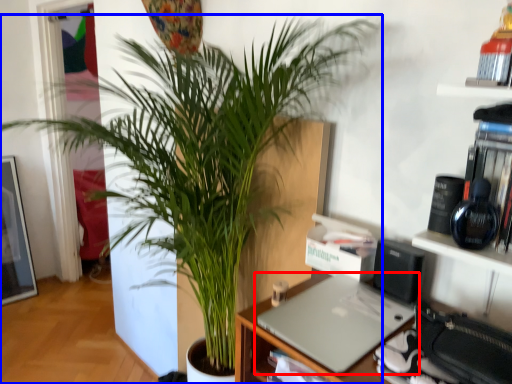
Question: Which point is closer to the camera, laptop (highlighted by a red box) or houseplant (highlighted by a blue box)?

Choices:
 (A) laptop
 (B) houseplant

Answer: (B)